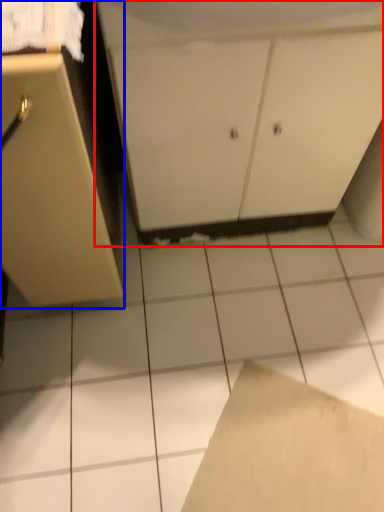
Question: Which object is further to the camera taking this photo, cabinetry (highlighted by a red box) or cabinetry (highlighted by a blue box)?

Choices:
 (A) cabinetry
 (B) cabinetry

Answer: (A)